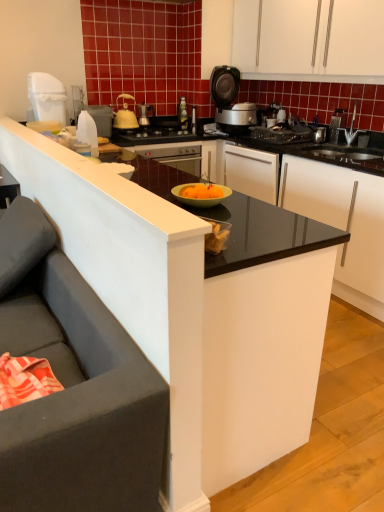
Question: Is white matte cabinet at upper center bigger or smaller than yellow matte kettle at upper center, the 3th kitchen appliance when ordered from left to right?

Choices:
 (A) big
 (B) small

Answer: (A)

Question: From the image's perspective, relative to yellow matte kettle at upper center, the 2th kitchen appliance positioned from the back, is white matte cabinet at upper center above or below?

Choices:
 (A) below
 (B) above

Answer: (B)

Question: Considering the real-world distances, which object is farthest from the yellow matte kettle at upper center, the 3th kitchen appliance when ordered from left to right?

Choices:
 (A) metallic silver coffee maker at upper center, acting as the 4th kitchen appliance starting from the left
 (B) dark gray fabric studio couch at left
 (C) white plastic bottle at left, arranged as the 2th kitchen appliance when viewed from the left
 (D) black glossy countertop at center
 (E) white plastic trash can at upper left, which is the third kitchen appliance in back-to-front order

Answer: (B)

Question: Based on their relative distances, which object is farther from the white plastic bottle at left, marked as the 3th kitchen appliance in a right-to-left arrangement?

Choices:
 (A) metallic silver coffee maker at upper center, acting as the 4th kitchen appliance starting from the left
 (B) yellow matte kettle at upper center, the 3th kitchen appliance when ordered from left to right
 (C) matte black rice cooker at upper center
 (D) black glossy countertop at center
 (E) white plastic trash can at upper left, which ranks as the fourth kitchen appliance in right-to-left order

Answer: (D)